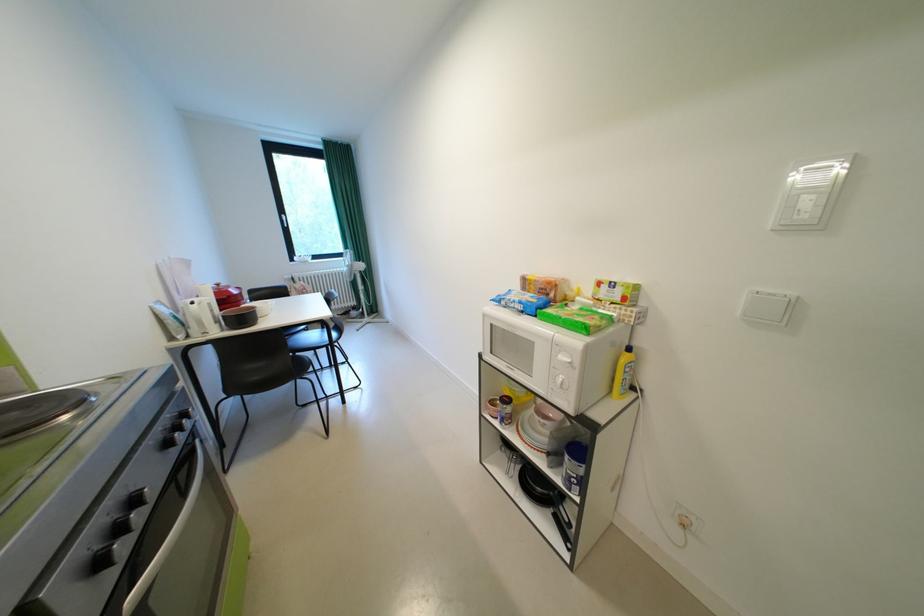
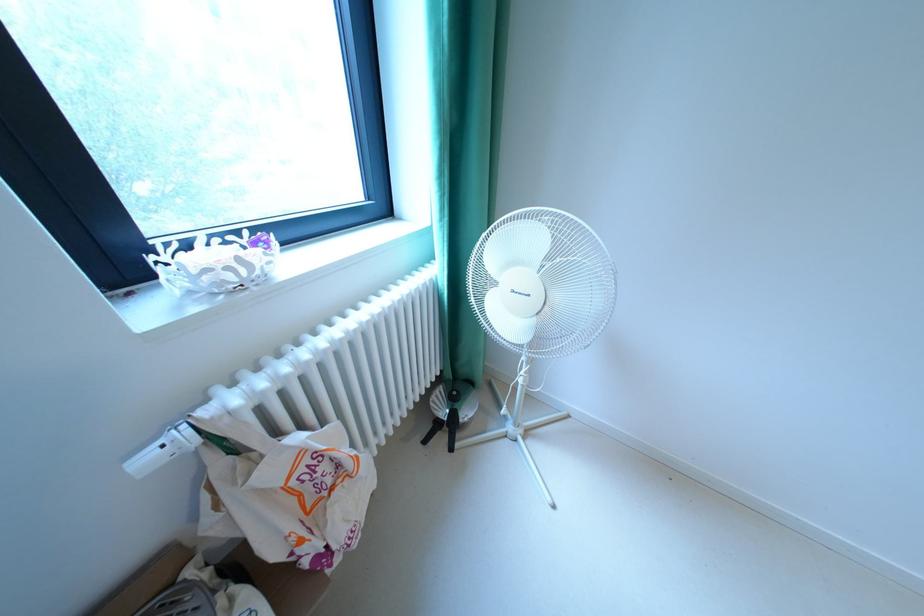
Which direction would the cameraman need to move to produce the second image?

The cameraman walked toward left, forward.